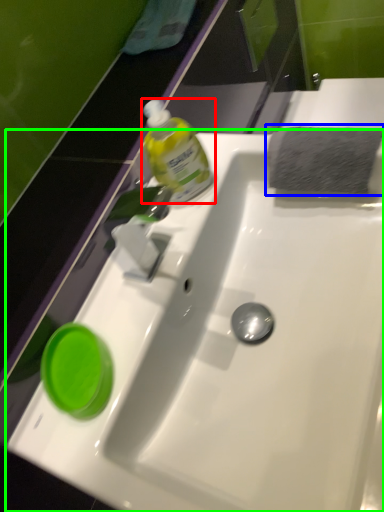
Question: Estimate the real-world distances between objects in this image. Which object is farther from bottle (highlighted by a red box), hand towel (highlighted by a blue box) or sink (highlighted by a green box)?

Choices:
 (A) hand towel
 (B) sink

Answer: (B)